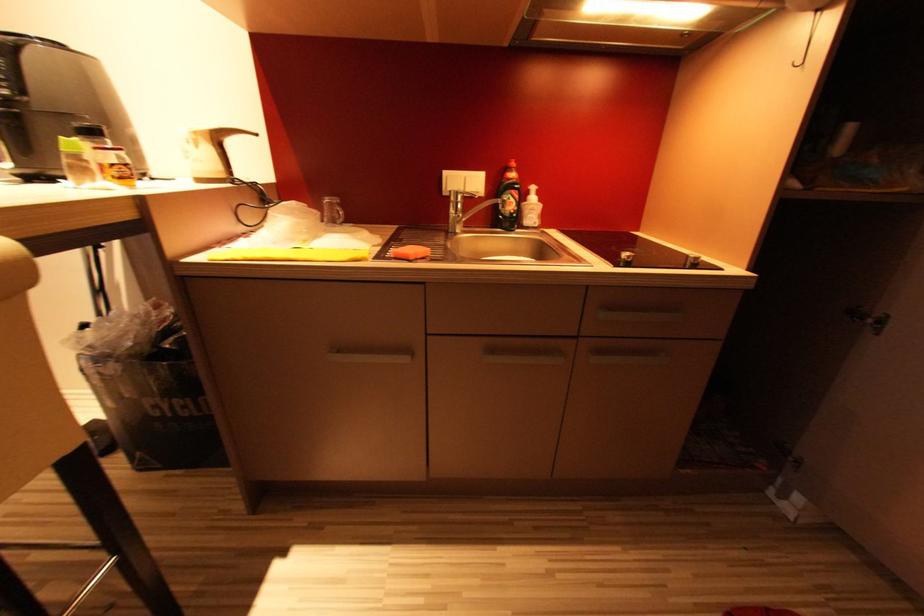
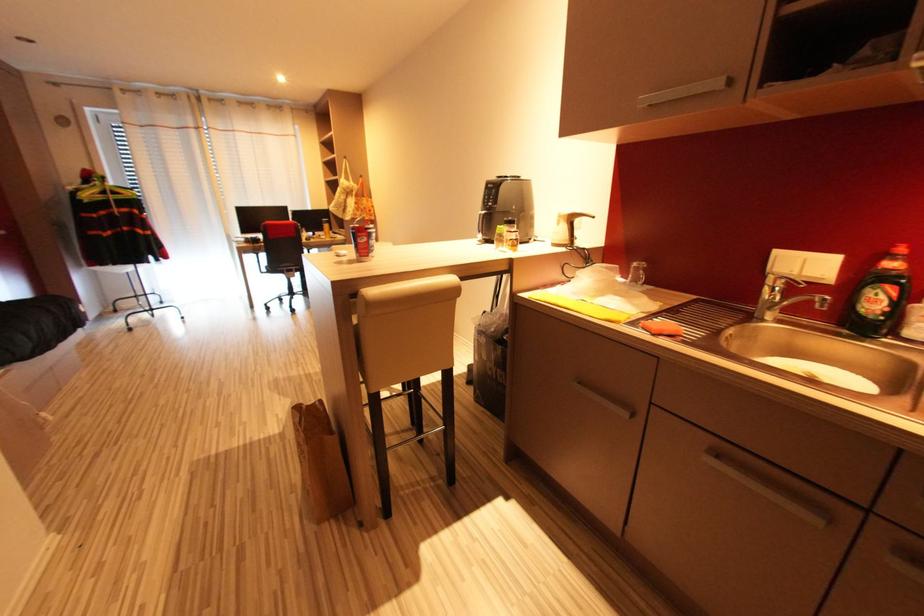
Question: How did the camera likely rotate?

Choices:
 (A) Left
 (B) Right
 (C) Up
 (D) Down

Answer: (A)